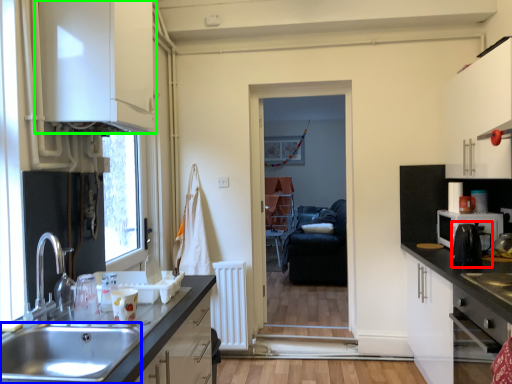
Question: Which object is positioned closest to coffee machine (highlighted by a red box)? Select from sink (highlighted by a blue box) and cabinetry (highlighted by a green box).

Choices:
 (A) sink
 (B) cabinetry

Answer: (A)